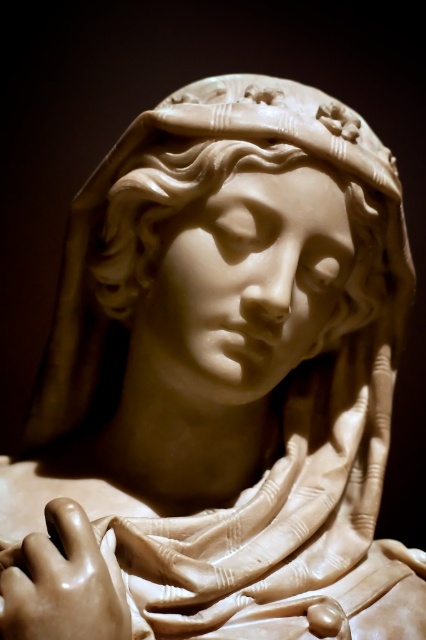
Between matte white sculpture at center and matte beige hand at lower left, which one is positioned lower?

matte beige hand at lower left is below.

Does matte white sculpture at center have a lesser width compared to matte beige hand at lower left?

No, matte white sculpture at center is not thinner than matte beige hand at lower left.

Does point (319, 109) come behind point (78, 504)?

Yes, it is behind point (78, 504).

This screenshot has height=640, width=426. In order to click on matte white sculpture at center in this screenshot , I will do `click(247, 170)`.